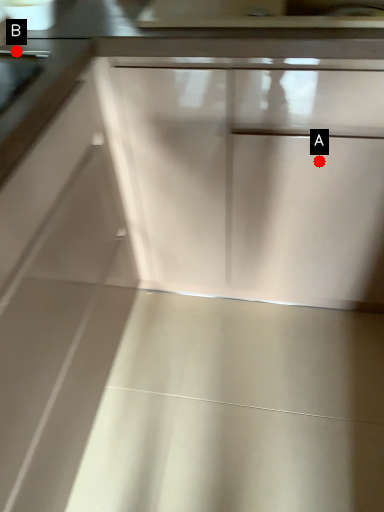
Question: Two points are circled on the image, labeled by A and B beside each circle. Which point appears farthest from the camera in this image?

Choices:
 (A) A is further
 (B) B is further

Answer: (A)